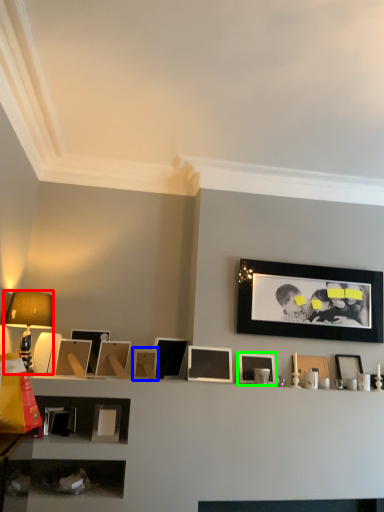
Question: Which is nearer to the table lamp (highlighted by a red box)? picture frame (highlighted by a blue box) or picture frame (highlighted by a green box).

Choices:
 (A) picture frame
 (B) picture frame

Answer: (A)